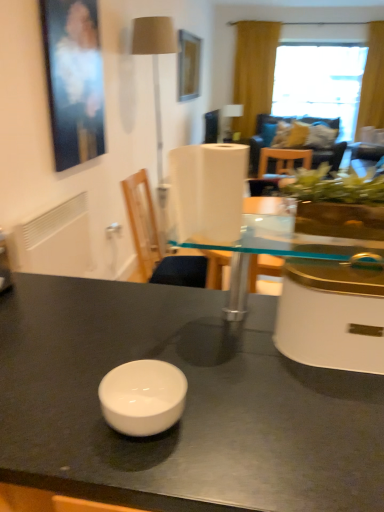
What are the coordinates of `blank space to the left of transparent glass table at center` in the screenshot? It's located at (112, 330).